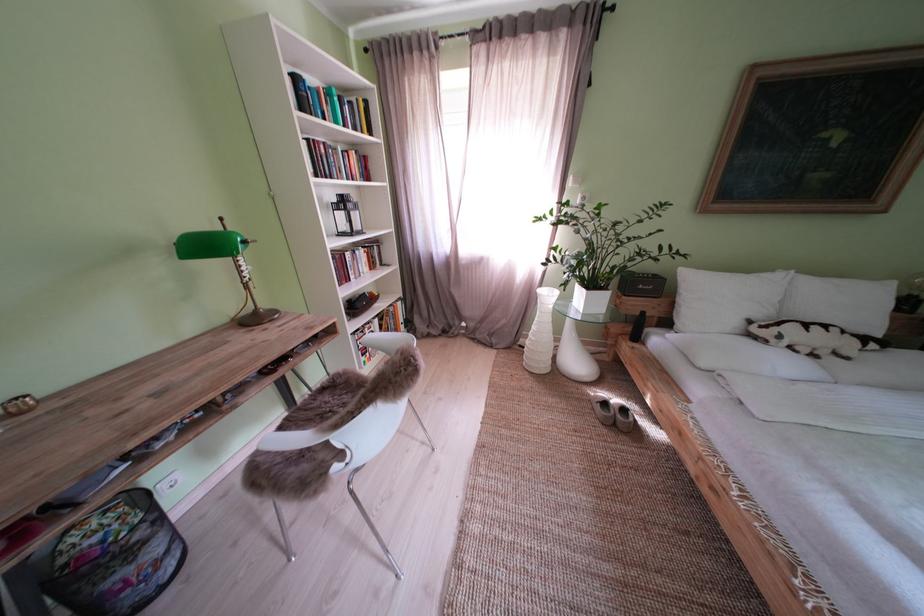
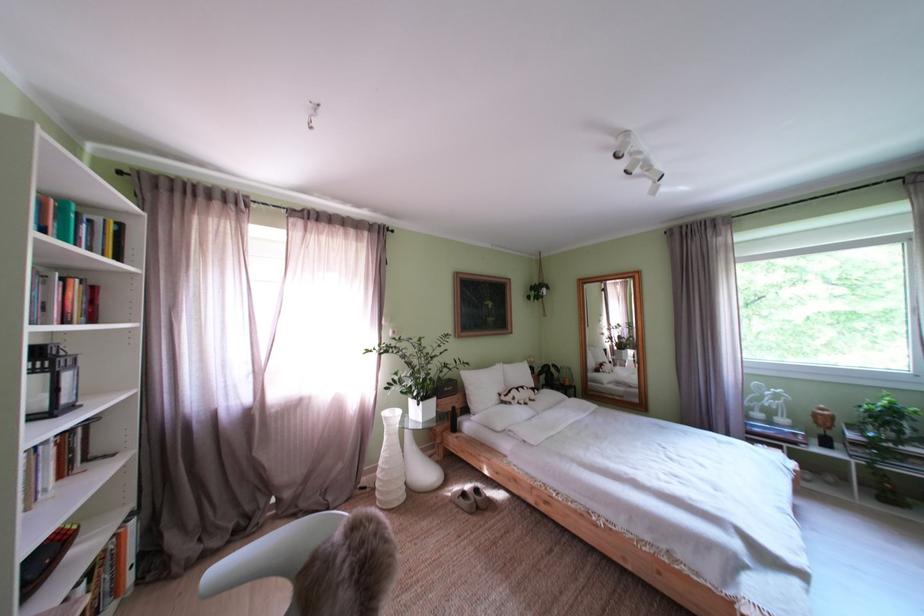
Where in the second image is the point corresponding to point (857, 359) from the first image?

(543, 403)